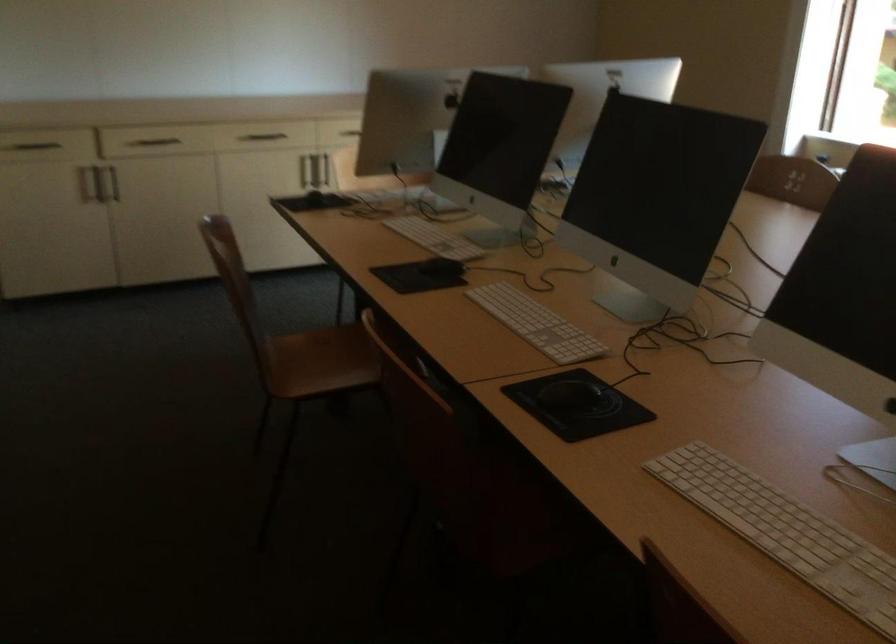
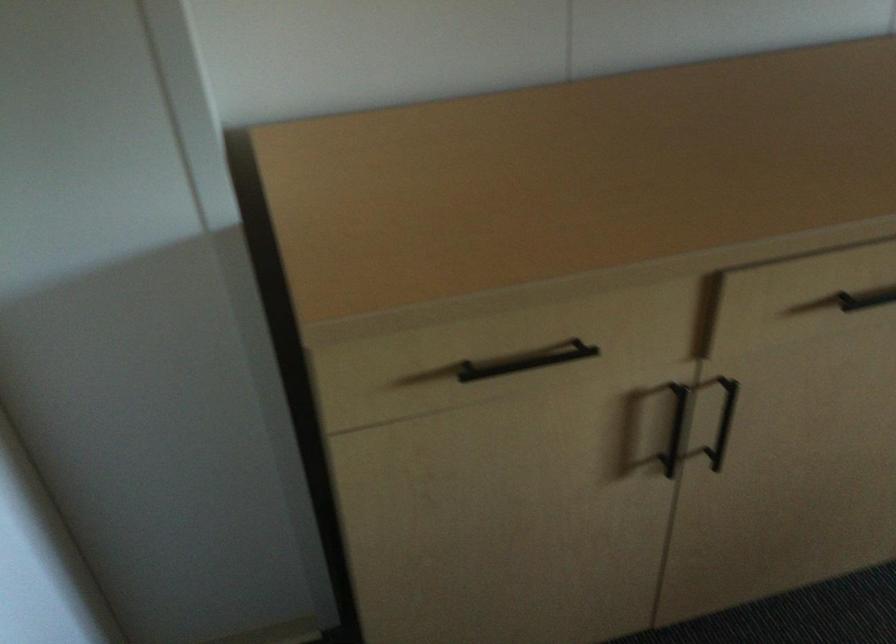
The point at (149,136) is marked in the first image. Where is the corresponding point in the second image?

(866, 299)